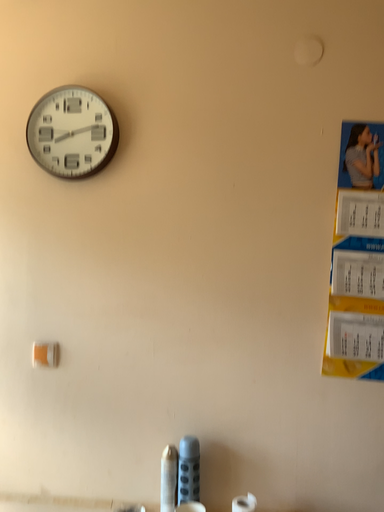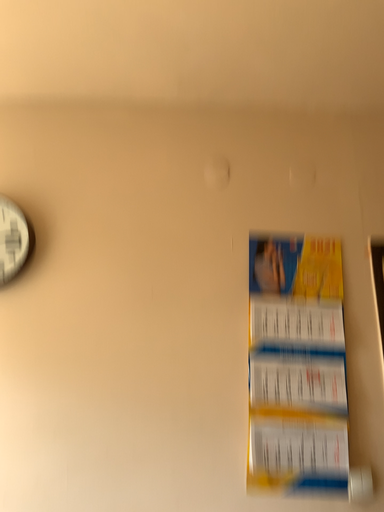
Question: Which way did the camera rotate in the video?

Choices:
 (A) rotated left
 (B) rotated right

Answer: (B)